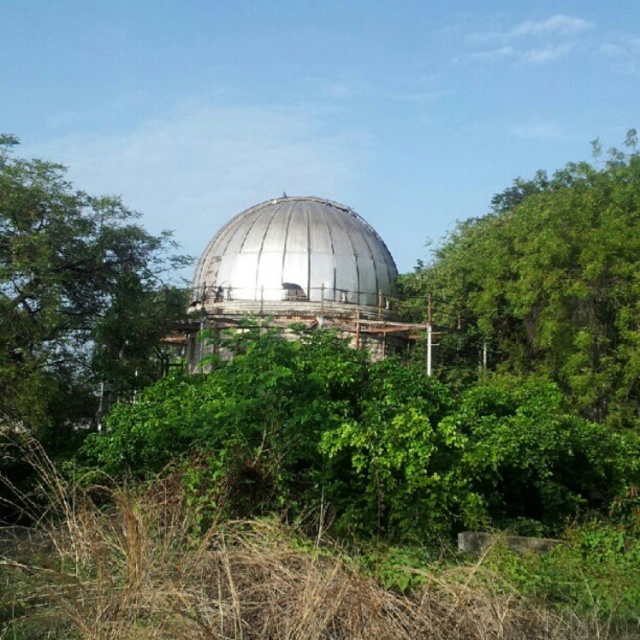
Question: Which object is the farthest from the green leafy tree at left?

Choices:
 (A) green leafy tree at upper right
 (B) metallic dome at center

Answer: (A)

Question: Is green leafy tree at left wider than metallic dome at center?

Choices:
 (A) no
 (B) yes

Answer: (A)

Question: In this image, where is green leafy tree at upper right located relative to metallic dome at center?

Choices:
 (A) left
 (B) right

Answer: (B)

Question: Which point is farther from the camera taking this photo?

Choices:
 (A) (224, 292)
 (B) (52, 330)

Answer: (A)

Question: Among these points, which one is nearest to the camera?

Choices:
 (A) coord(333,288)
 (B) coord(4,419)
 (C) coord(564,262)

Answer: (B)

Question: Does green leafy tree at left have a lesser width compared to metallic dome at center?

Choices:
 (A) no
 (B) yes

Answer: (B)